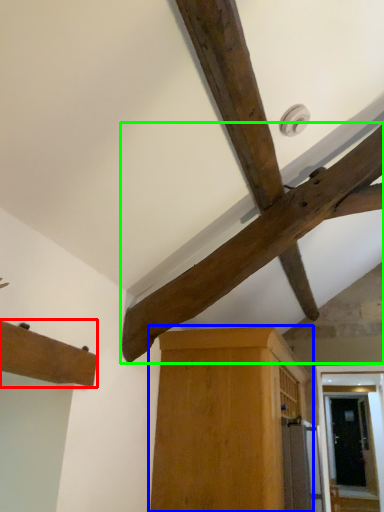
Question: Estimate the real-world distances between objects in this image. Which object is closer to cabinetry (highlighted by a red box), cabinetry (highlighted by a blue box) or beam (highlighted by a green box)?

Choices:
 (A) cabinetry
 (B) beam

Answer: (B)